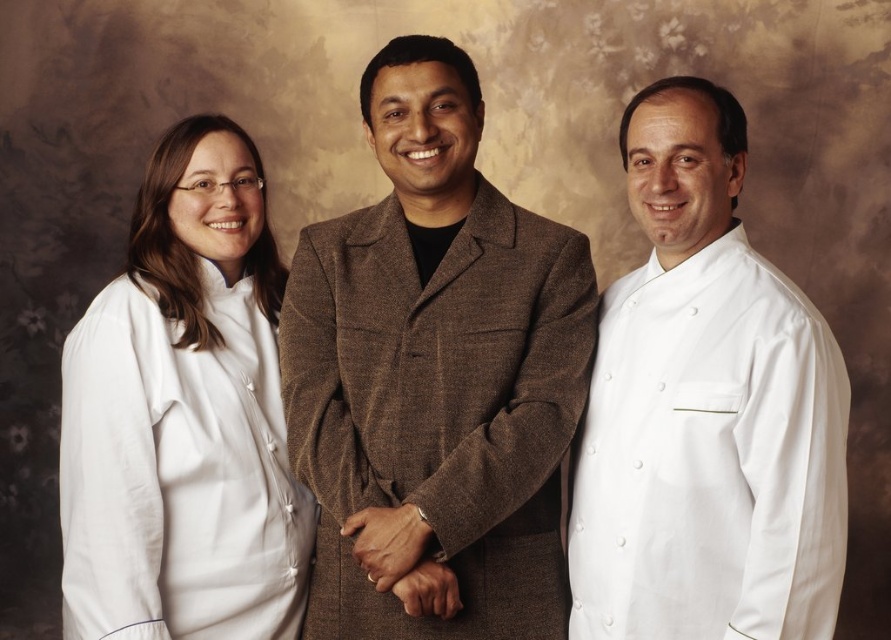
Question: Which of the following is the closest to the observer?

Choices:
 (A) (428, 96)
 (B) (676, 538)
 (C) (129, 596)

Answer: (B)

Question: Does brown woolen suit at center have a smaller size compared to white smooth chef coat at right?

Choices:
 (A) no
 (B) yes

Answer: (A)

Question: Estimate the real-world distances between objects in this image. Which object is farther from the white smooth chef coat at right?

Choices:
 (A) white fabric at left
 (B) brown woolen suit at center

Answer: (A)

Question: Can you confirm if brown woolen suit at center is positioned above white fabric at left?

Choices:
 (A) yes
 (B) no

Answer: (A)

Question: Is white smooth chef coat at right behind white fabric at left?

Choices:
 (A) no
 (B) yes

Answer: (A)

Question: Which of these objects is positioned closest to the white fabric at left?

Choices:
 (A) white smooth chef coat at right
 (B) brown woolen suit at center

Answer: (B)